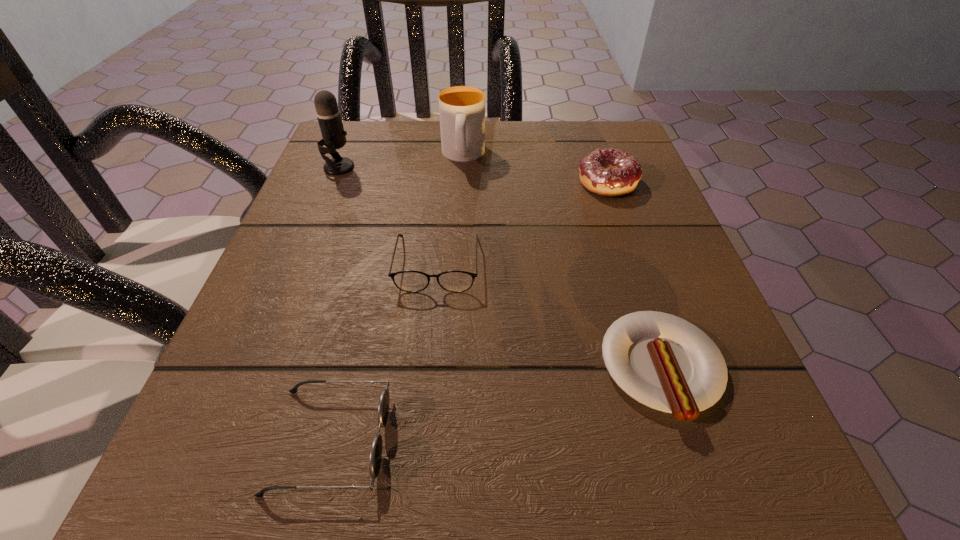
Locate an element on the screen. sausage that is at the right edge is located at coordinates (662, 361).

Find the location of a particular element. This screenshot has height=540, width=960. object that is at the far left corner is located at coordinates (328, 114).

At what (x,y) coordinates should I click in order to perform the action: click on object present at the near left corner. Please return your answer as a coordinate pair (x, y). The height and width of the screenshot is (540, 960). Looking at the image, I should click on (375, 458).

The width and height of the screenshot is (960, 540). Find the location of `object that is at the far right corner`. object that is at the far right corner is located at coordinates 608,172.

You are a GUI agent. You are given a task and a screenshot of the screen. Output one action in this format:
    pyautogui.click(x=<x>, y=<y>)
    Task: Click on the vacant region at the far edge
    
    Given the screenshot: What is the action you would take?
    pyautogui.click(x=531, y=123)

Locate an element on the screen. The height and width of the screenshot is (540, 960). vacant region at the near edge is located at coordinates (523, 475).

Find the location of a particular element. This screenshot has width=960, height=540. vacant space at the left edge is located at coordinates (249, 402).

The image size is (960, 540). Identify the location of vacant space at the right edge of the desktop. (654, 195).

In the image, there is a desktop. Where is `blank space at the far left corner`? Image resolution: width=960 pixels, height=540 pixels. blank space at the far left corner is located at coordinates (389, 172).

The image size is (960, 540). In the image, there is a desktop. Identify the location of vacant space at the near left corner. (258, 461).